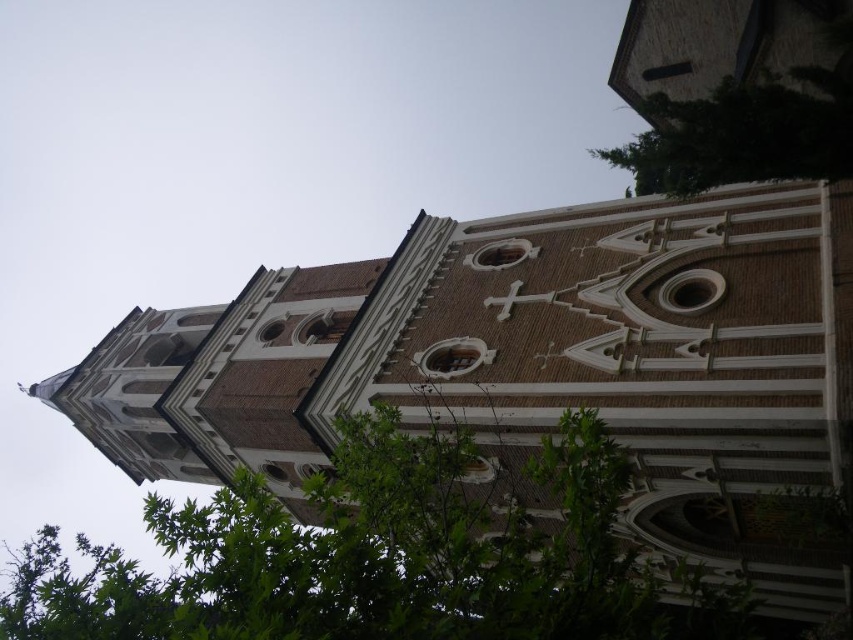
You are standing at the base of the church tower and want to take a photo of the point marked at coordinates point (x=573, y=580). If your camera has a maximum focus range of 30 meters, will you be able to capture the point clearly?

The distance of point (x=573, y=580) from camera is 35.72 meters, which exceeds the camera maximum focus range of 30 meters. Therefore, you will not be able to capture the point clearly.

Based on the scene described, which tree, the green leafy tree at lower left or the green leafy tree at upper right, is wider?

The green leafy tree at lower left might be wider than the green leafy tree at upper right.